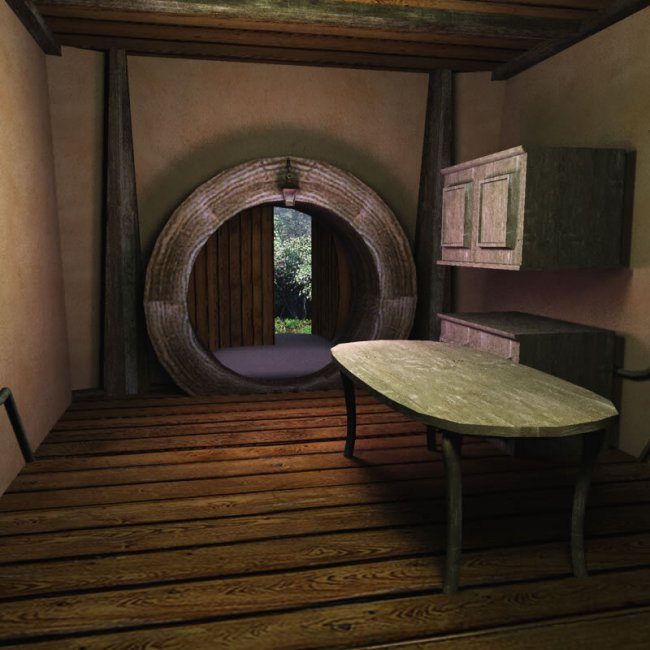
Where is `wood panels`? This screenshot has width=650, height=650. wood panels is located at coordinates (313, 473), (343, 538).